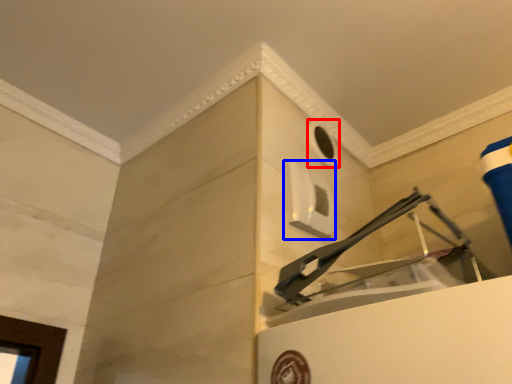
Question: Which of the following is the closest to the observer, hole (highlighted by a red box) or window (highlighted by a blue box)?

Choices:
 (A) hole
 (B) window

Answer: (B)